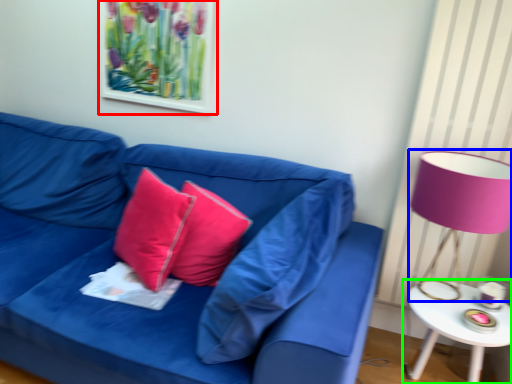
Question: Which is farther away from picture frame (highlighted by a red box)? table lamp (highlighted by a blue box) or table (highlighted by a green box)?

Choices:
 (A) table lamp
 (B) table

Answer: (B)